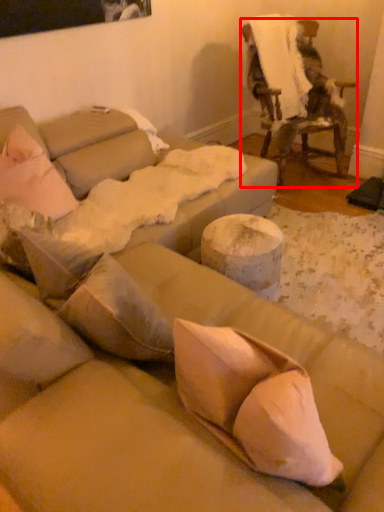
Question: From the image's perspective, where is chair (annotated by the red box) located relative to linen?

Choices:
 (A) above
 (B) below

Answer: (B)